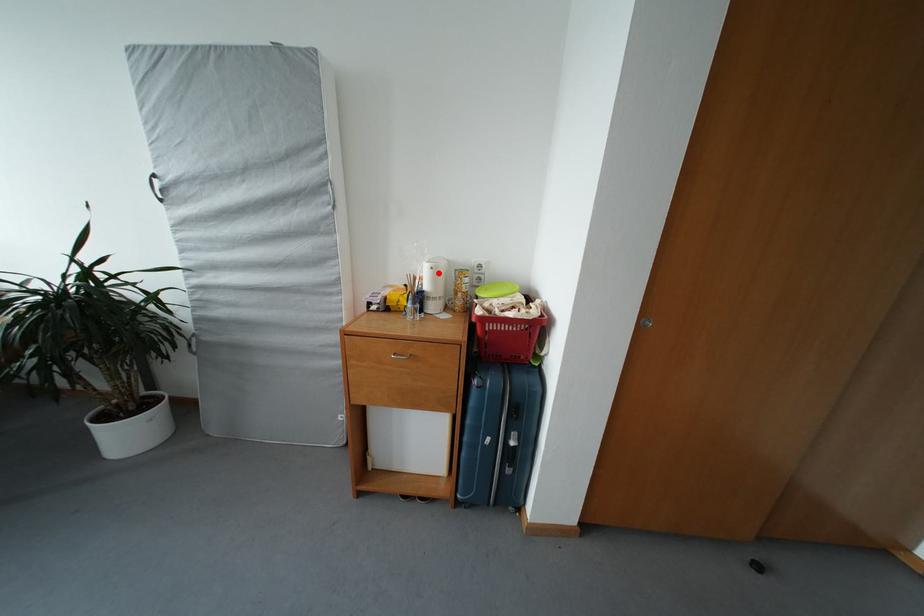
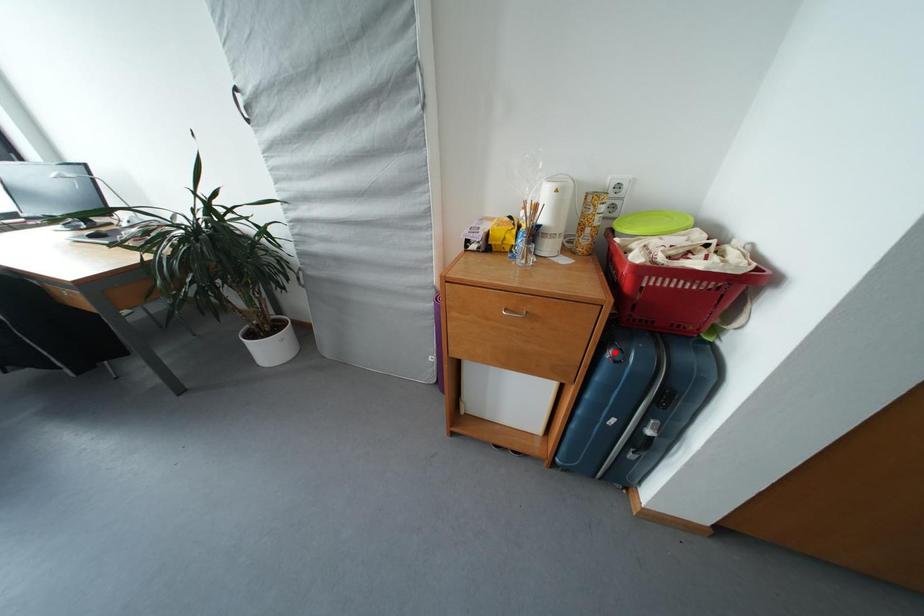
I am providing you with two images of the same scene from different viewpoints. A red point is marked on the first image and another point is marked on the second image. Is the red point in image1 aligned with the point shown in image2?

No